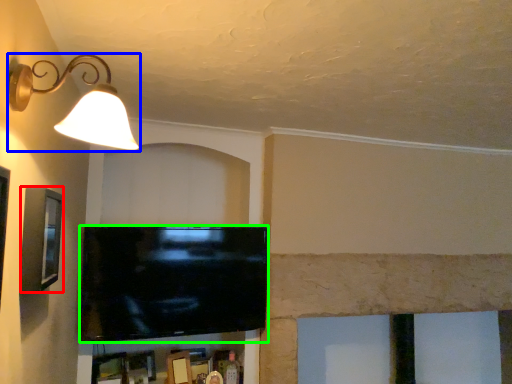
Question: Which object is the closest to the picture frame (highlighted by a red box)? Choose among these: lamp (highlighted by a blue box) or television (highlighted by a green box).

Choices:
 (A) lamp
 (B) television

Answer: (A)